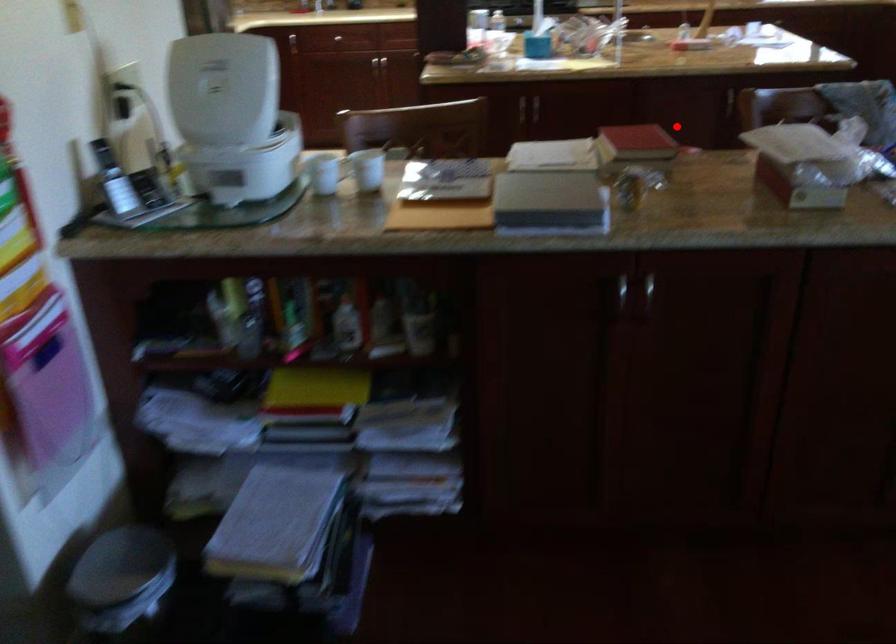
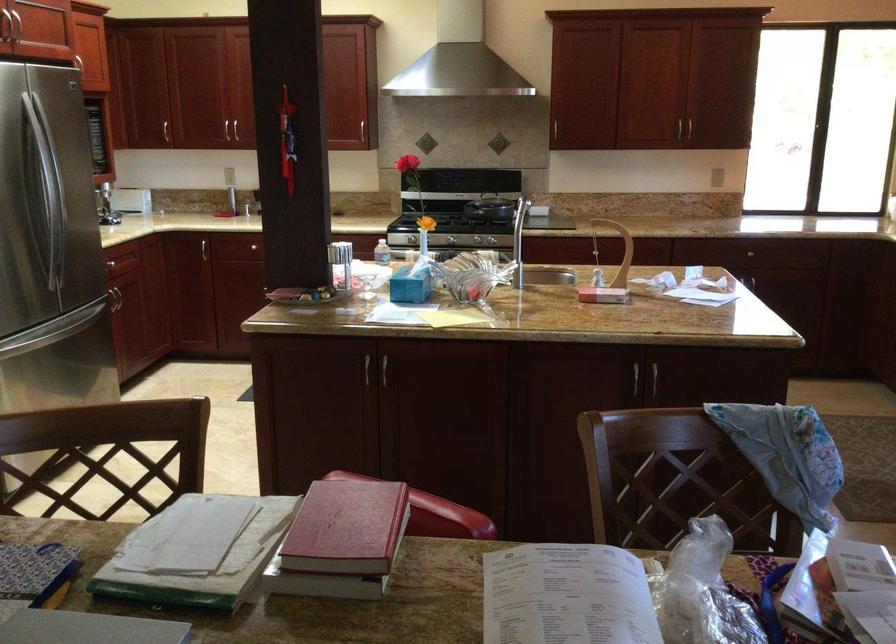
The point at the highlighted location is marked in the first image. Where is the corresponding point in the second image?

(535, 404)